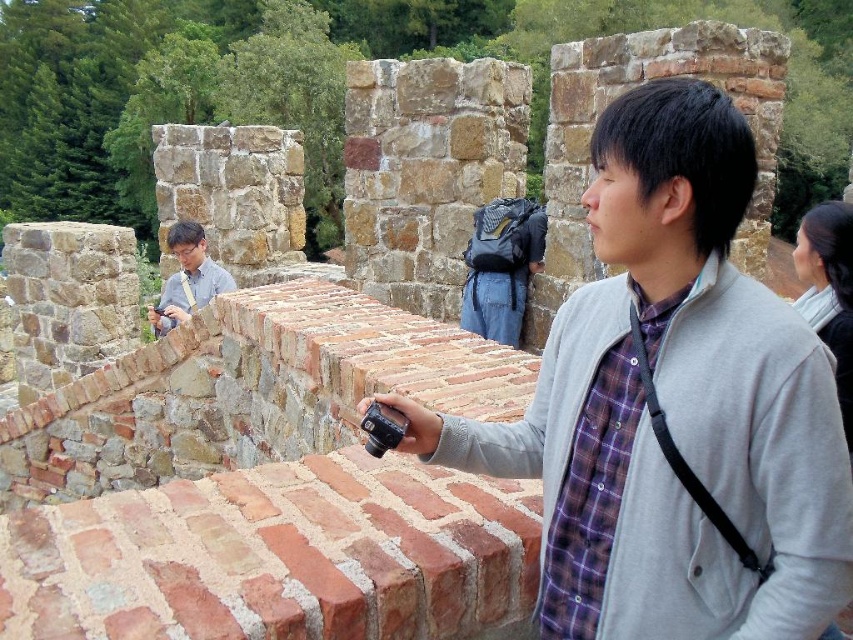
Does gray matte jacket at center come behind matte gray shirt at center?

No, it is not.

Who is positioned more to the left, gray matte jacket at center or matte gray shirt at center?

matte gray shirt at center

Describe the element at coordinates (672, 404) in the screenshot. The image size is (853, 640). I see `gray matte jacket at center` at that location.

Identify the location of gray matte jacket at center. The image size is (853, 640). (672, 404).